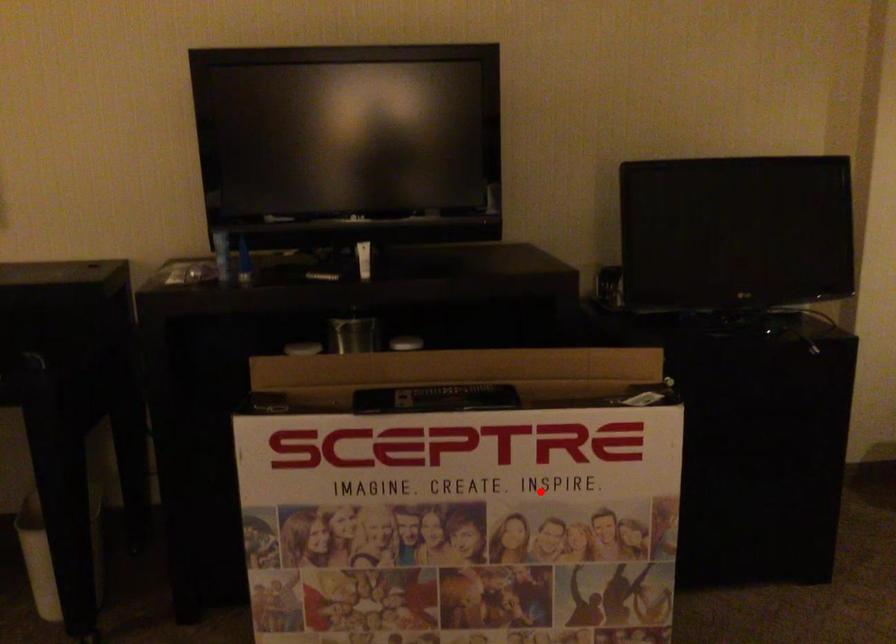
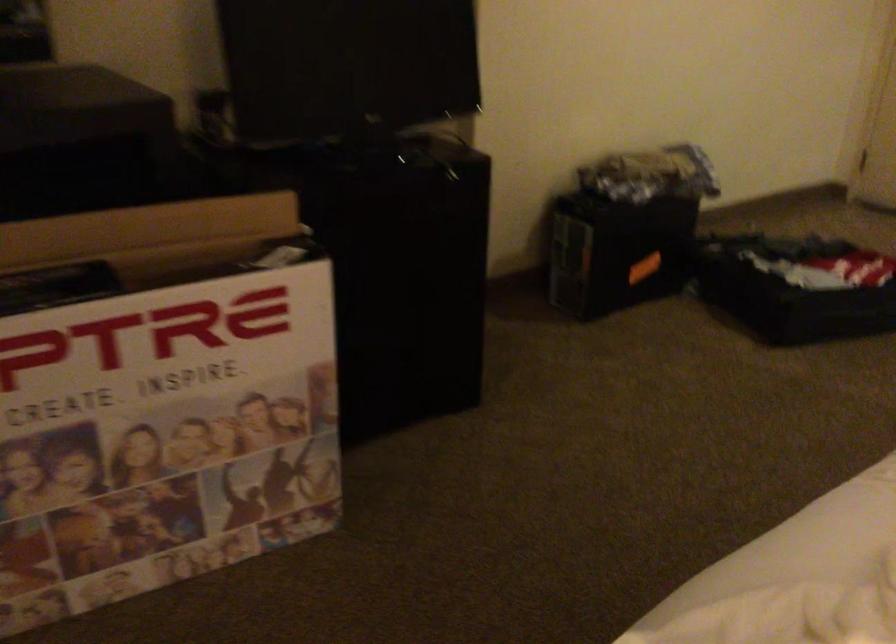
Question: I am providing you with two images of the same scene from different viewpoints. A red point is shown in image1. For the corresponding object point in image2, is it positioned nearer or farther from the camera?

Choices:
 (A) Nearer
 (B) Farther

Answer: (A)